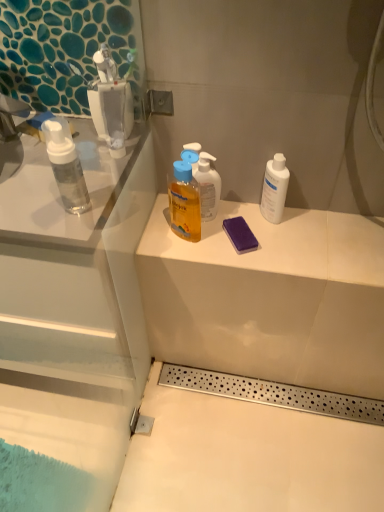
Question: Is matte white counter at center taller or shorter than translucent yellow liquid at upper center?

Choices:
 (A) tall
 (B) short

Answer: (B)

Question: Is matte white counter at center bigger or smaller than translucent yellow liquid at upper center?

Choices:
 (A) small
 (B) big

Answer: (B)

Question: Which is farther from the translucent yellow liquid at upper center?

Choices:
 (A) purple sponge at center
 (B) matte white counter at center
 (C) white matte bottle at right

Answer: (C)

Question: Which of these objects is positioned closest to the translucent yellow liquid at upper center?

Choices:
 (A) white matte bottle at right
 (B) matte white counter at center
 (C) purple sponge at center

Answer: (C)